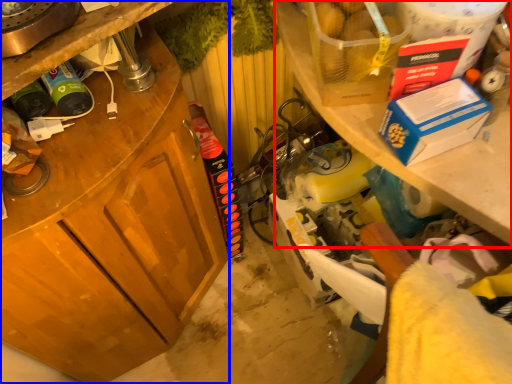
Question: Which object is further to the camera taking this photo, shelf (highlighted by a red box) or cabinetry (highlighted by a blue box)?

Choices:
 (A) shelf
 (B) cabinetry

Answer: (A)